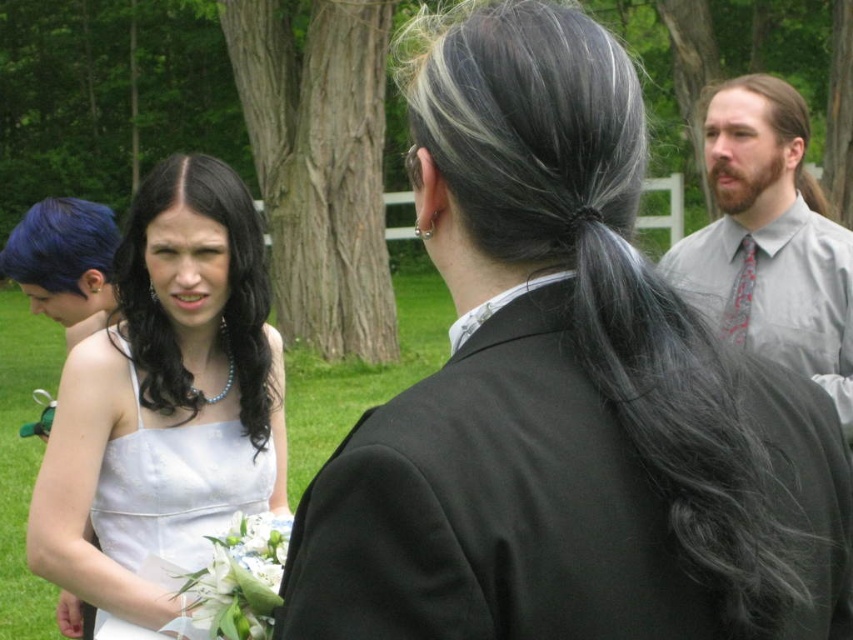
Is blue matte hair at left to the left of red silk tie at right from the viewer's perspective?

Correct, you'll find blue matte hair at left to the left of red silk tie at right.

Does blue matte hair at left have a larger size compared to red silk tie at right?

Indeed, blue matte hair at left has a larger size compared to red silk tie at right.

Where is `blue matte hair at left`? This screenshot has height=640, width=853. blue matte hair at left is located at coordinates (61, 244).

Is white satin dress at left behind brown matte hair at upper right?

No.

Between point (71, 509) and point (805, 132), which one is positioned in front?

Point (71, 509) is in front.

The height and width of the screenshot is (640, 853). I want to click on white satin dress at left, so click(166, 384).

Can you confirm if white satin dress at left is positioned above gray shirt with tie at upper right?

Incorrect, white satin dress at left is not positioned above gray shirt with tie at upper right.

Which is in front, point (82, 436) or point (831, 221)?

Point (82, 436) is more forward.

I want to click on white satin dress at left, so click(166, 384).